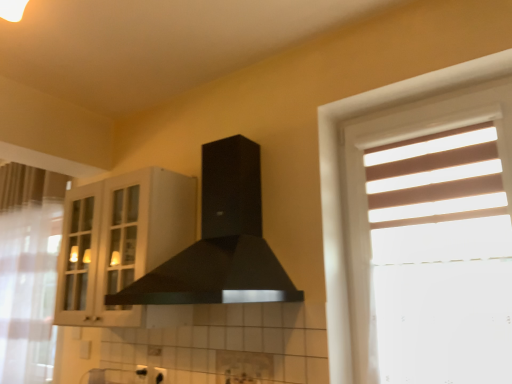
Question: In terms of size, does clear glass screen door at left appear bigger or smaller than white sheer curtain at left?

Choices:
 (A) big
 (B) small

Answer: (B)

Question: From a real-world perspective, is clear glass screen door at left above or below white sheer curtain at left?

Choices:
 (A) below
 (B) above

Answer: (B)

Question: Which of these objects is positioned farthest from the clear glass screen door at left?

Choices:
 (A) white glass cabinet at upper left
 (B) black matte fume hood at center
 (C) white sheer curtain at left

Answer: (C)

Question: Estimate the real-world distances between objects in this image. Which object is closer to the black matte fume hood at center?

Choices:
 (A) white glass cabinet at upper left
 (B) white sheer curtain at left
 (C) clear glass screen door at left

Answer: (A)